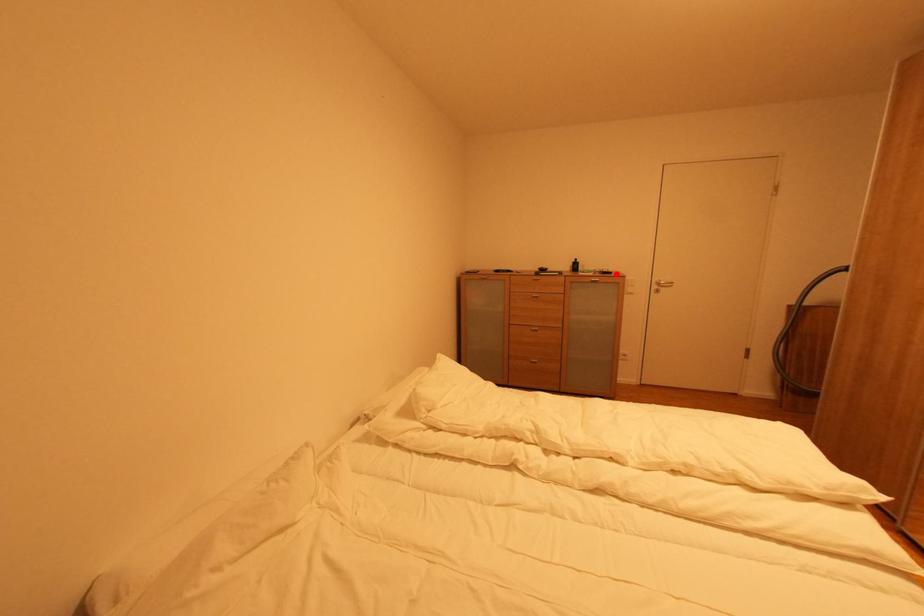
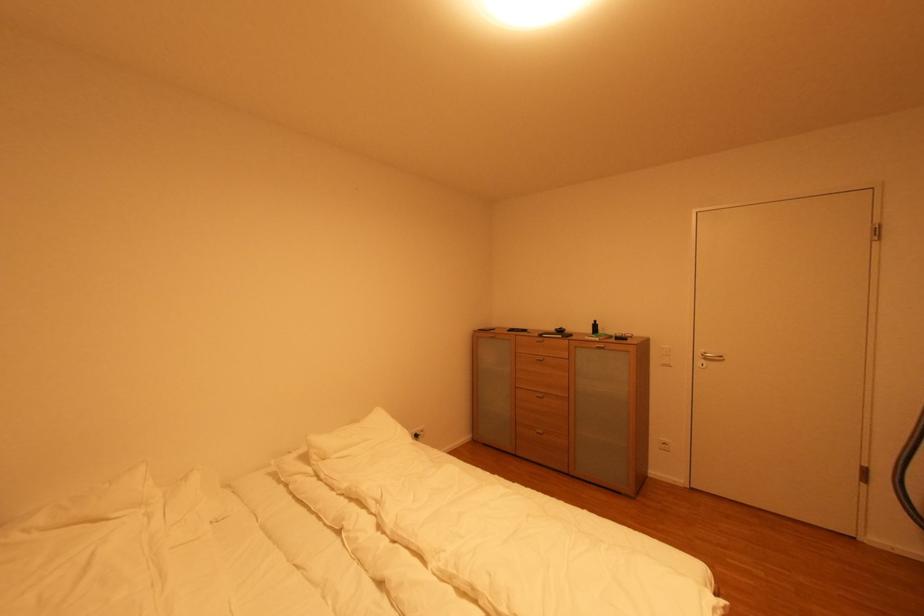
In the second image, find the point that corresponds to the highlighted location in the first image.

(630, 339)